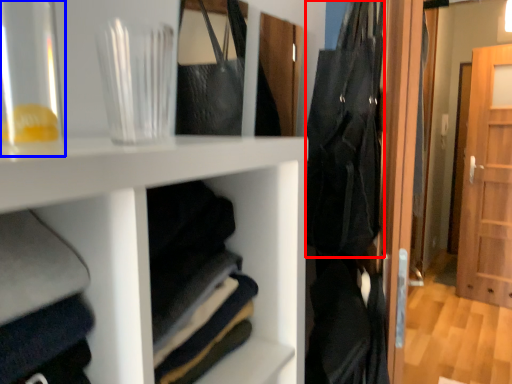
Question: Which of the following is the farthest to the observer, clothing (highlighted by a red box) or glass vase (highlighted by a blue box)?

Choices:
 (A) clothing
 (B) glass vase

Answer: (A)